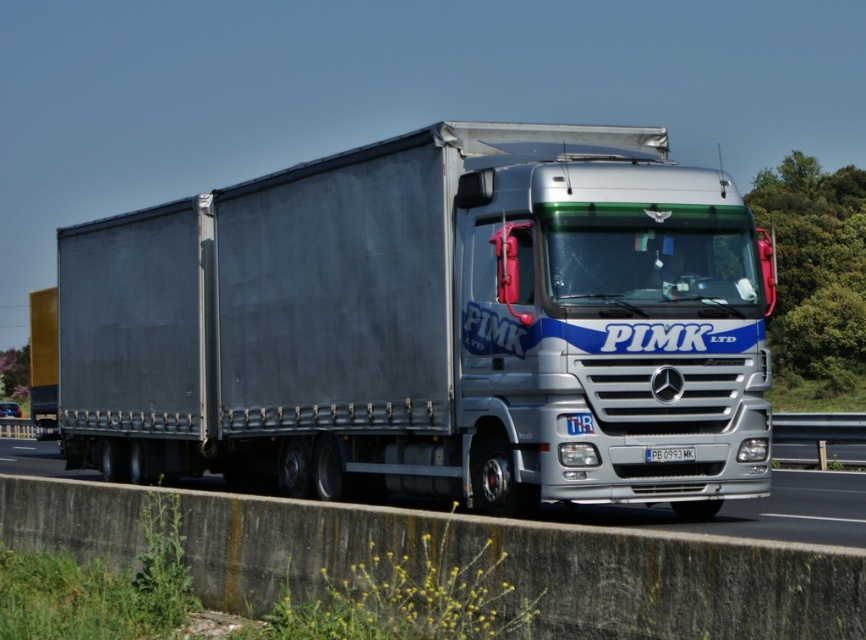
Is silver metallic trailer truck at center bigger than blue plastic license plate at center?

Correct, silver metallic trailer truck at center is larger in size than blue plastic license plate at center.

Describe the element at coordinates (430, 324) in the screenshot. I see `silver metallic trailer truck at center` at that location.

At what (x,y) coordinates should I click in order to perform the action: click on silver metallic trailer truck at center. Please return your answer as a coordinate pair (x, y). This screenshot has height=640, width=866. Looking at the image, I should click on (430, 324).